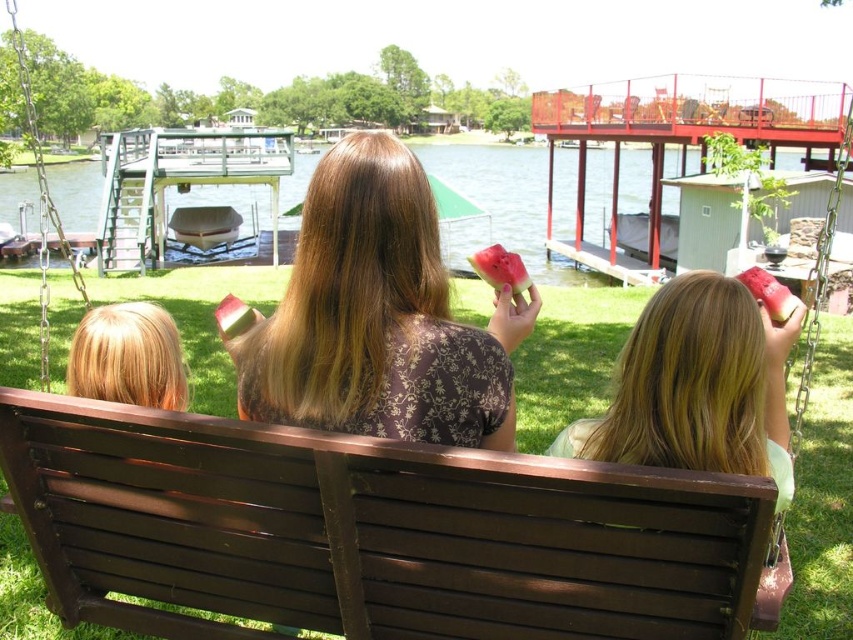
You are standing at the entrance of the dock and want to sit on the brown wooden bench at center. Which direction should you walk to reach it?

Since the brown wooden bench at center is located at point (368, 531), you should walk towards the center of the image to reach it.

You are a photographer trying to capture a photo of the brown floral shirt at center and the brushed metal boat at center. Since you want both subjects to be in the frame, which object should you position closer to the left side of your camera viewfinder?

The brushed metal boat at center should be positioned closer to the left side of the camera viewfinder because the brown floral shirt at center is to the right of the brushed metal boat at center.